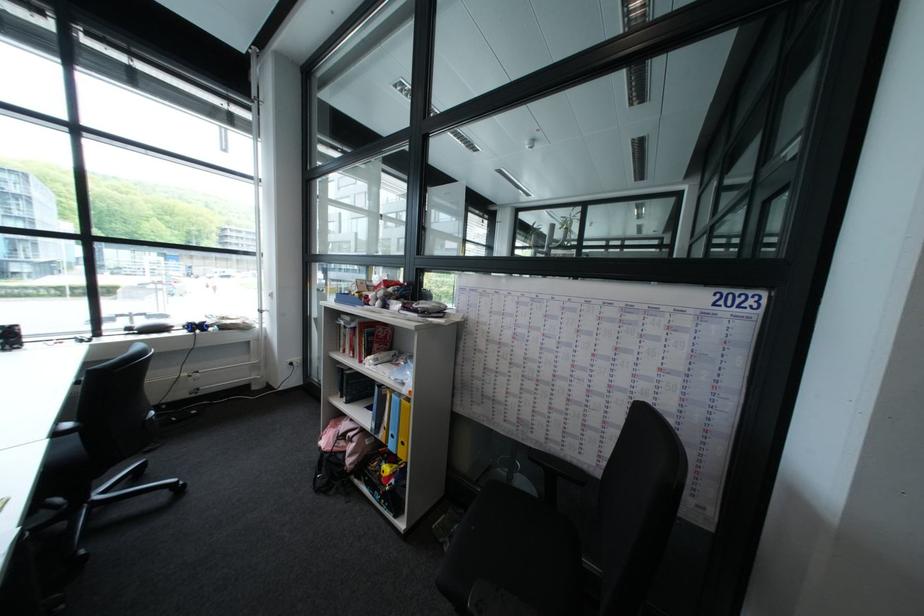
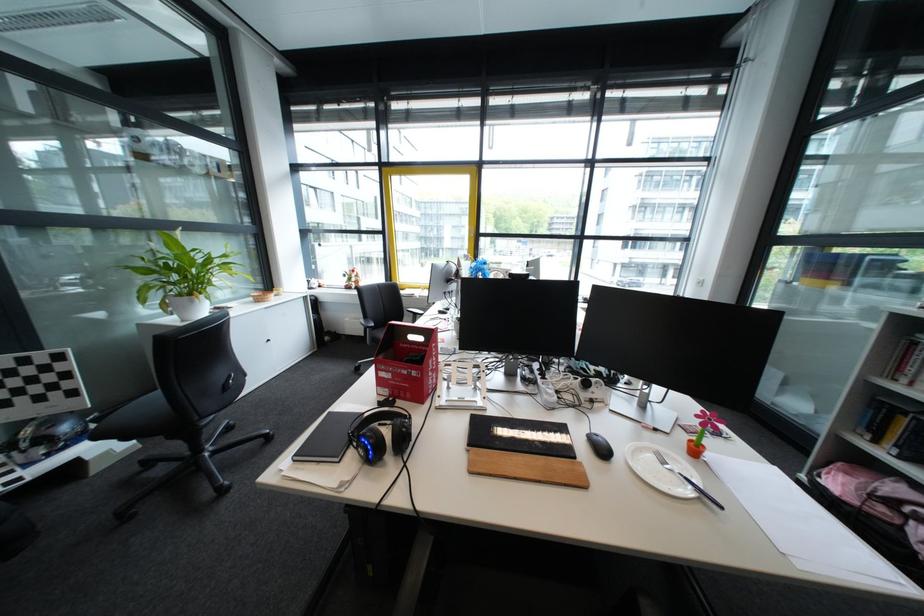
Question: I am providing you with two images of the same scene from different viewpoints. After the viewpoint changes to image2, which objects are now occluded?

Choices:
 (A) black notebook
 (B) gaming controller
 (C) yellow door handle
 (D) white magazine

Answer: (B)